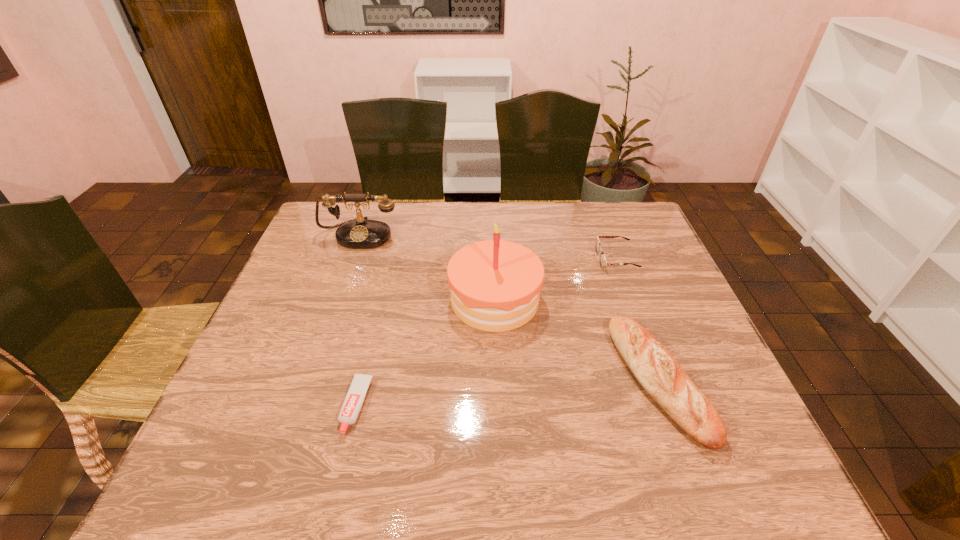
The height and width of the screenshot is (540, 960). Identify the location of free region located on the frame of the spectacles. tap(502, 259).

Find the location of a particular element. The width and height of the screenshot is (960, 540). free region located on the frame of the spectacles is located at coordinates (505, 259).

Image resolution: width=960 pixels, height=540 pixels. Find the location of `free location located on the left of the shortest object`. free location located on the left of the shortest object is located at coordinates (228, 406).

Locate an element on the screen. object located at the far edge is located at coordinates (359, 233).

Where is `object present at the near edge`? Image resolution: width=960 pixels, height=540 pixels. object present at the near edge is located at coordinates (659, 373).

What are the coordinates of `object located at the left edge` in the screenshot? It's located at (x=359, y=233).

In order to click on baguet positioned at the right edge in this screenshot , I will do `click(659, 373)`.

Image resolution: width=960 pixels, height=540 pixels. What are the coordinates of `spectacles located at the right edge` in the screenshot? It's located at [x=603, y=262].

Where is `object that is at the far left corner`? object that is at the far left corner is located at coordinates (359, 233).

Find the location of `object that is at the near right corner`. object that is at the near right corner is located at coordinates click(659, 373).